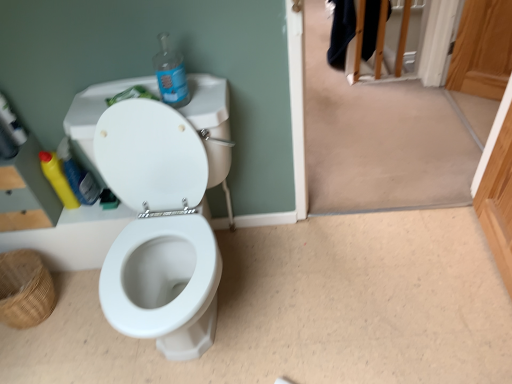
Where is `empty space that is ontop of brown woven basket at lower left (from a real-world perspective)`? empty space that is ontop of brown woven basket at lower left (from a real-world perspective) is located at coordinates (10, 274).